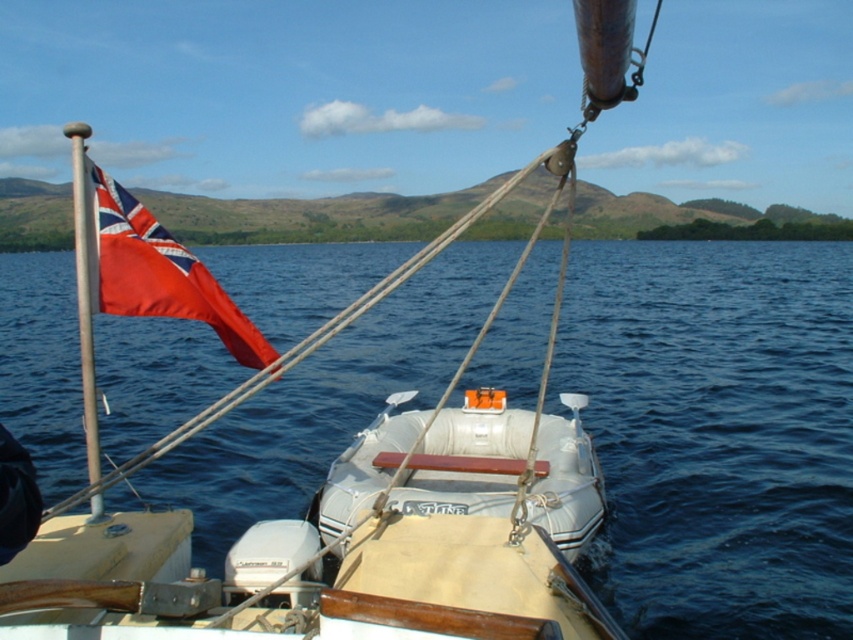
Find the location of a particular element. The height and width of the screenshot is (640, 853). satin red flag at upper left is located at coordinates (155, 272).

Describe the element at coordinates (155, 272) in the screenshot. This screenshot has width=853, height=640. I see `satin red flag at upper left` at that location.

Image resolution: width=853 pixels, height=640 pixels. What are the coordinates of `satin red flag at upper left` in the screenshot? It's located at (155, 272).